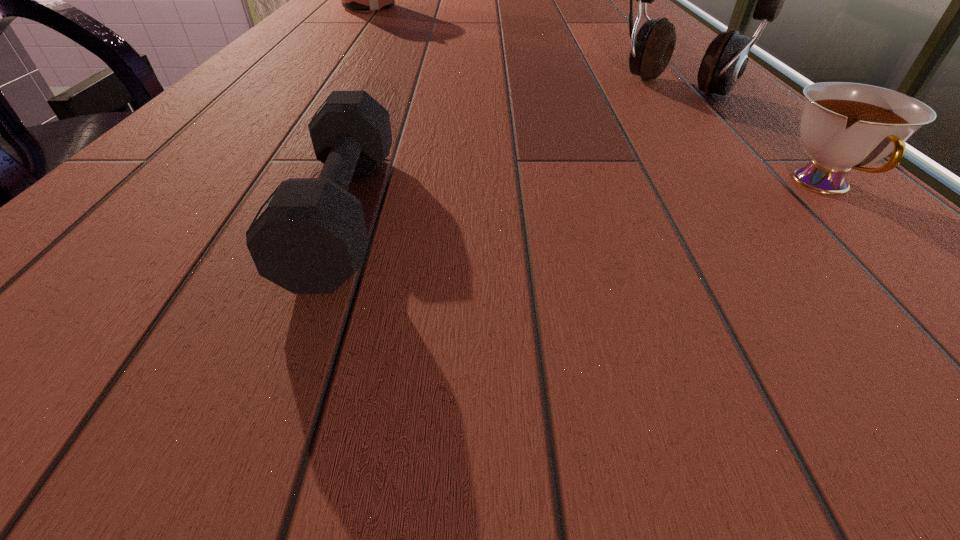
This screenshot has width=960, height=540. In order to click on free space on the desktop that is between the third object from right to left and the teacup and is positioned on the side with the handle of the mug in this screenshot , I will do `click(593, 198)`.

Find the location of a particular element. The height and width of the screenshot is (540, 960). vacant space on the desktop that is between the third object from right to left and the teacup and is positioned on the ear pads of the third nearest object is located at coordinates (523, 202).